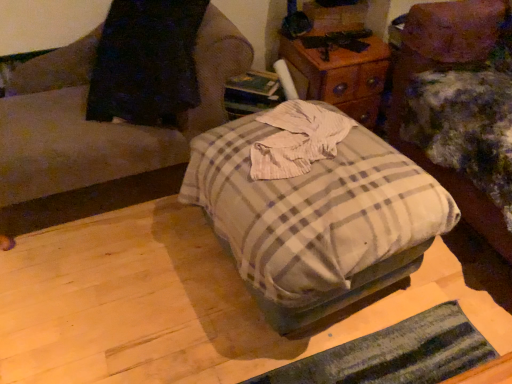
At what (x,y) coordinates should I click in order to perform the action: click on free space above wooden nightstand at upper center (from a real-world perspective). Please return your answer as a coordinate pair (x, y). Looking at the image, I should click on (336, 40).